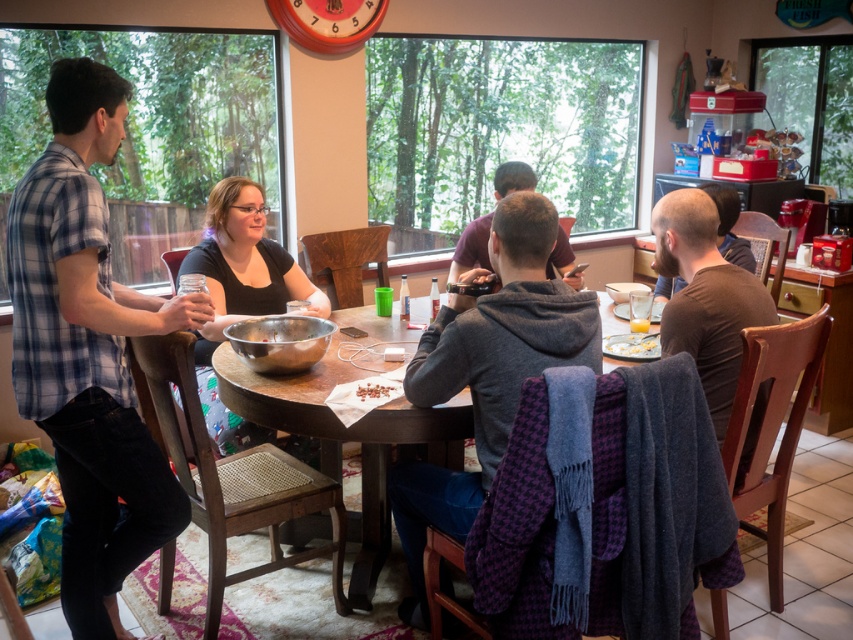
Does point (674, 221) come closer to viewer compared to point (364, 381)?

Yes, point (674, 221) is in front of point (364, 381).

The height and width of the screenshot is (640, 853). I want to click on brown matte shirt at right, so click(705, 298).

Between metallic bowl at center and shiny chocolate bar at center, which one has less height?

shiny chocolate bar at center is shorter.

Which is behind, point (277, 321) or point (370, 396)?

Positioned behind is point (277, 321).

Who is more distant from viewer, (294, 332) or (364, 385)?

The point (294, 332) is behind.

At what (x,y) coordinates should I click in order to perform the action: click on metallic bowl at center. Please return your answer as a coordinate pair (x, y). The height and width of the screenshot is (640, 853). Looking at the image, I should click on (279, 340).

Who is taller, metallic bowl at center or matte brown shirt at center?

matte brown shirt at center is taller.

Looking at this image, does metallic bowl at center appear on the left side of matte brown shirt at center?

Indeed, metallic bowl at center is positioned on the left side of matte brown shirt at center.

The image size is (853, 640). What do you see at coordinates (279, 340) in the screenshot?
I see `metallic bowl at center` at bounding box center [279, 340].

Locate an element on the screen. metallic bowl at center is located at coordinates (279, 340).